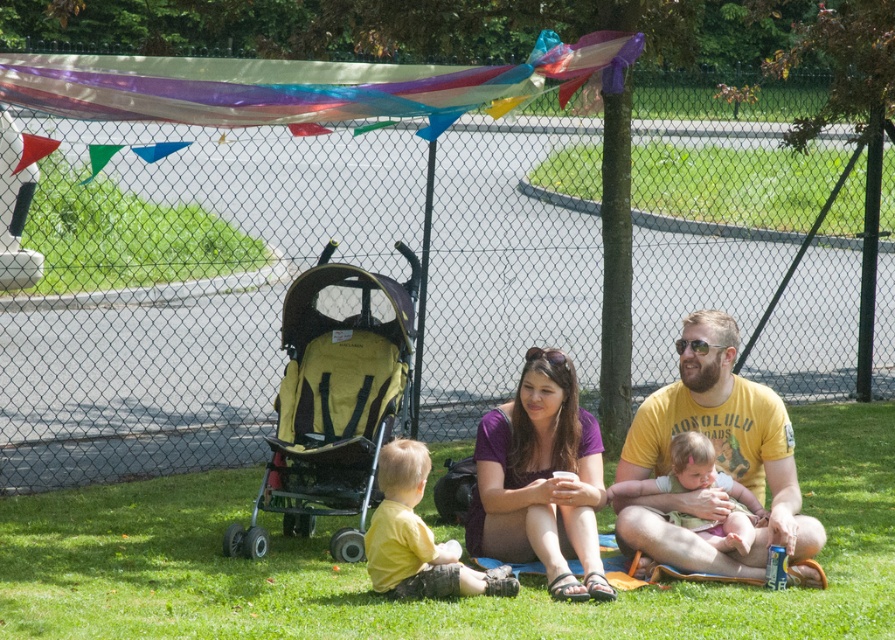
You are standing in the park and want to take a photo of both the point at position (753, 552) and the point at position (382, 448). Which point should you focus on first to ensure both are in focus?

You should focus on the point at position (753, 552) first because it is closer to the camera than the point at position (382, 448). This ensures that both points will be in focus when using a camera with a fixed focal length.